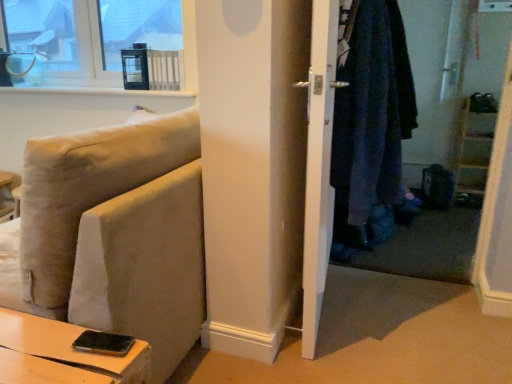
Question: Is denim jacket at right wider or thinner than white glossy door at center?

Choices:
 (A) thin
 (B) wide

Answer: (B)

Question: From the image's perspective, is denim jacket at right located above or below white glossy door at center?

Choices:
 (A) below
 (B) above

Answer: (B)

Question: Estimate the real-world distances between objects in this image. Which object is farther from the beige fabric couch at lower left?

Choices:
 (A) denim jacket at right
 (B) white glossy door at center
 (C) clear glass window at upper left

Answer: (C)

Question: Based on their relative distances, which object is farther from the clear glass window at upper left?

Choices:
 (A) white glossy door at center
 (B) beige fabric couch at lower left
 (C) denim jacket at right

Answer: (C)